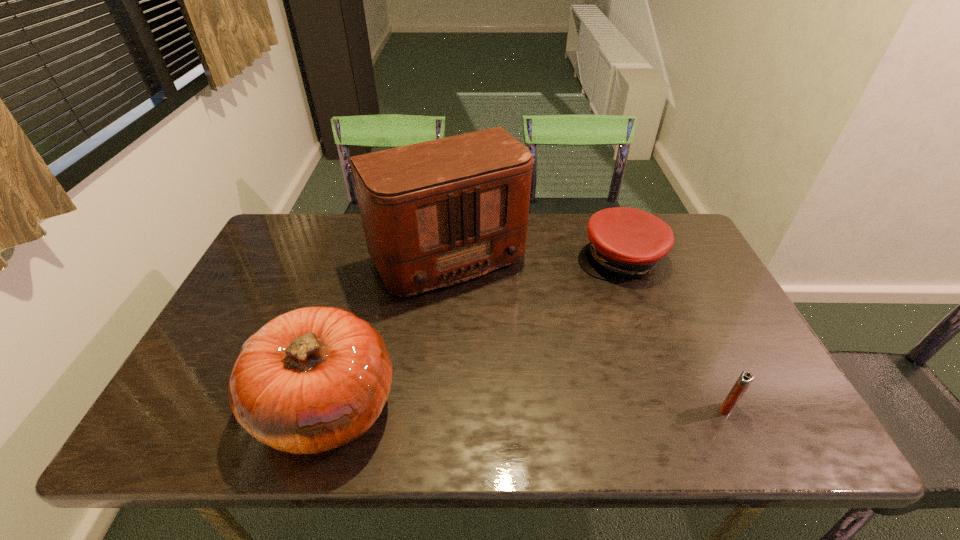
I want to click on vacant space at the far edge, so click(552, 222).

Identify the location of vacant space at the near edge. This screenshot has width=960, height=540. (485, 402).

Where is `vacant space at the left edge`? The width and height of the screenshot is (960, 540). vacant space at the left edge is located at coordinates (240, 326).

Where is `free space at the right edge of the desktop`? free space at the right edge of the desktop is located at coordinates (745, 344).

The height and width of the screenshot is (540, 960). I want to click on vacant area at the far left corner, so click(x=278, y=220).

This screenshot has height=540, width=960. In order to click on vacant space at the far right corner in this screenshot , I will do `click(698, 256)`.

This screenshot has width=960, height=540. What are the coordinates of `free space between the pumpkin and the tallest object` in the screenshot? It's located at (384, 331).

Where is `vacant space that's between the igniter and the second tallest object`? This screenshot has width=960, height=540. vacant space that's between the igniter and the second tallest object is located at coordinates (527, 407).

The width and height of the screenshot is (960, 540). I want to click on free area in between the igniter and the tallest object, so click(584, 333).

The width and height of the screenshot is (960, 540). What are the coordinates of `vacant area that lies between the tallest object and the cap` in the screenshot? It's located at (530, 258).